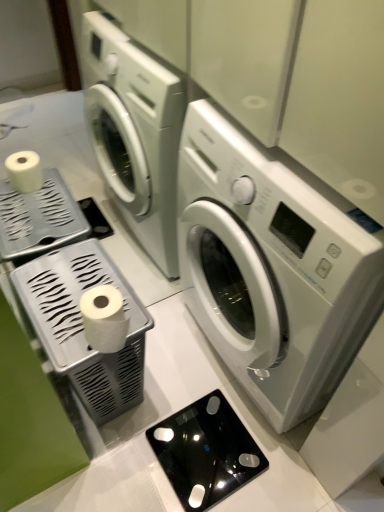
Where is `vacant space in front of white plastic tissue holder at left, which is the 2th appliance from right to left`? vacant space in front of white plastic tissue holder at left, which is the 2th appliance from right to left is located at coordinates (111, 473).